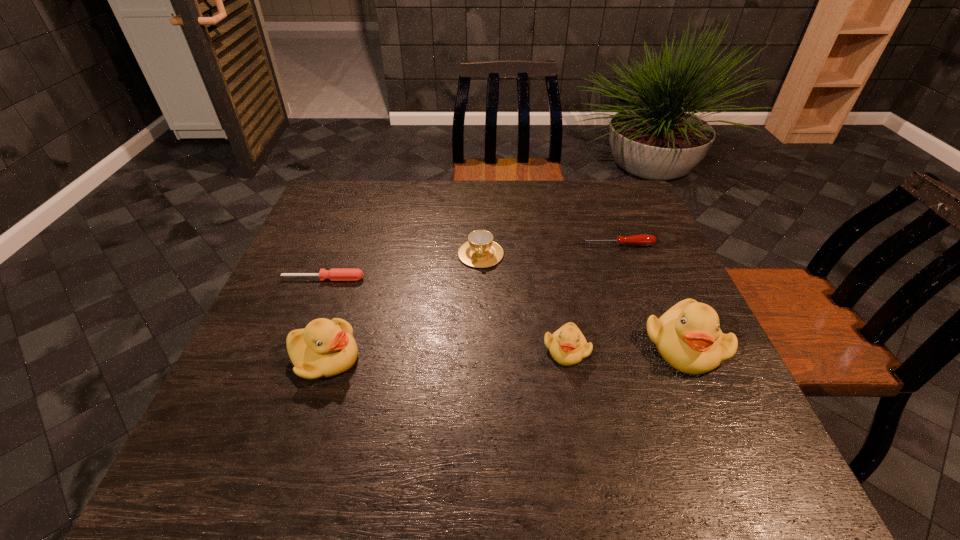
Locate an element on the screen. The width and height of the screenshot is (960, 540). vacant space located at the face of the second tallest object is located at coordinates (491, 357).

The image size is (960, 540). I want to click on vacant position located at the face of the third object from right to left, so click(575, 397).

At what (x,y) coordinates should I click in order to perform the action: click on free space located at the face of the rightmost duckling. Please return your answer as a coordinate pair (x, y). The image size is (960, 540). Looking at the image, I should click on (708, 399).

Find the location of a particular element. vacant area situated 0.080m with the handle on the side of the fourth tallest object is located at coordinates (481, 290).

Find the location of a particular element. The width and height of the screenshot is (960, 540). free space located 0.220m on the front of the left screwdriver is located at coordinates (295, 352).

The width and height of the screenshot is (960, 540). I want to click on vacant space located 0.310m on the back of the farther screwdriver, so click(594, 185).

Locate an element on the screen. The width and height of the screenshot is (960, 540). duckling located in the left edge section of the desktop is located at coordinates (325, 348).

The height and width of the screenshot is (540, 960). What are the coordinates of `screwdriver at the left edge` in the screenshot? It's located at (335, 274).

What are the coordinates of `duckling located at the right edge` in the screenshot? It's located at (688, 337).

Identify the location of screwdriver that is positioned at the right edge. The image size is (960, 540). (641, 240).